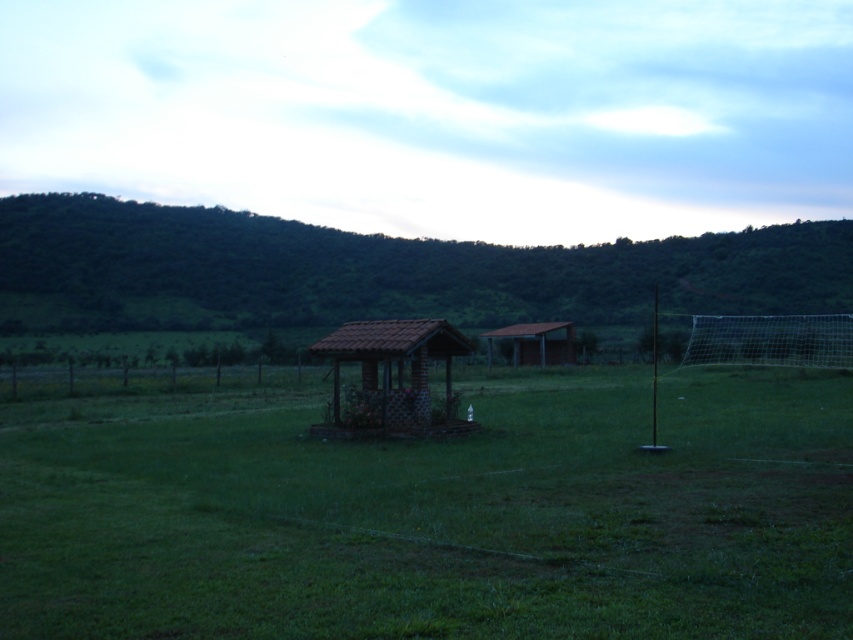
You are a landscape architect designing a new garden. You need to place a new statue that requires a 5 meter wide space. You see the green grassy field at center and the brown corrugated metal hut at center. Which area can accommodate the statue?

The green grassy field at center has a width that surpasses the brown corrugated metal hut at center, so the green grassy field at center can accommodate the statue as it is wider.